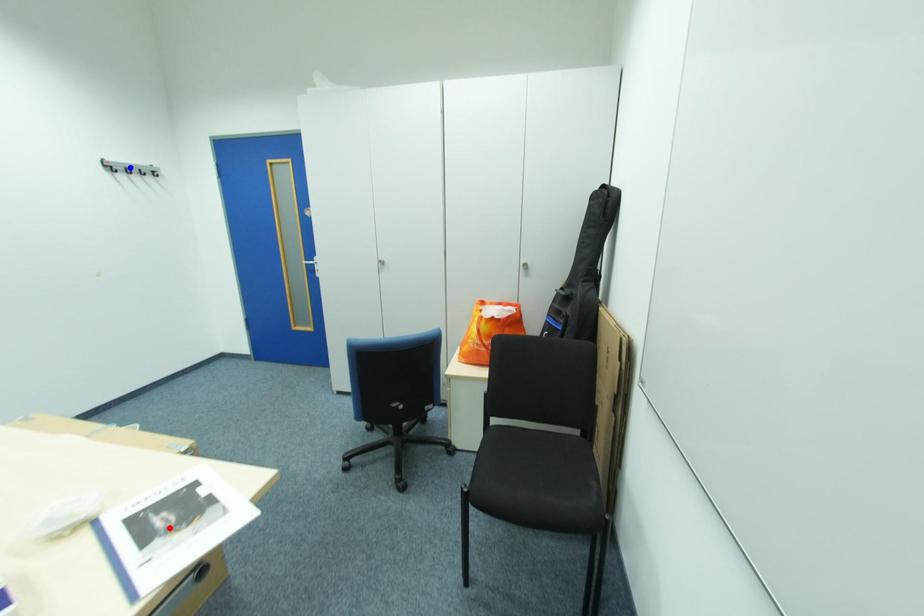
Question: In the image, two points are highlighted. Which point is nearer to the camera? Reply with the corresponding letter.

Choices:
 (A) blue point
 (B) red point

Answer: (B)